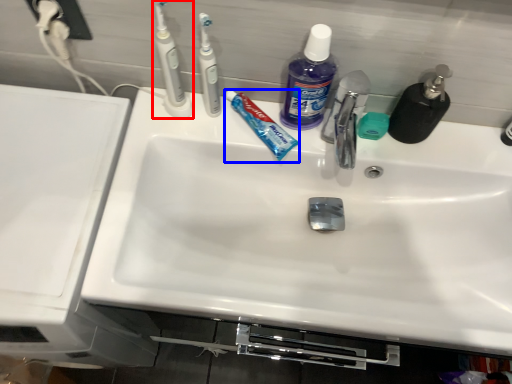
Question: Which of the following is the closest to the observer, toothbrush (highlighted by a red box) or toothpaste (highlighted by a blue box)?

Choices:
 (A) toothbrush
 (B) toothpaste

Answer: (A)